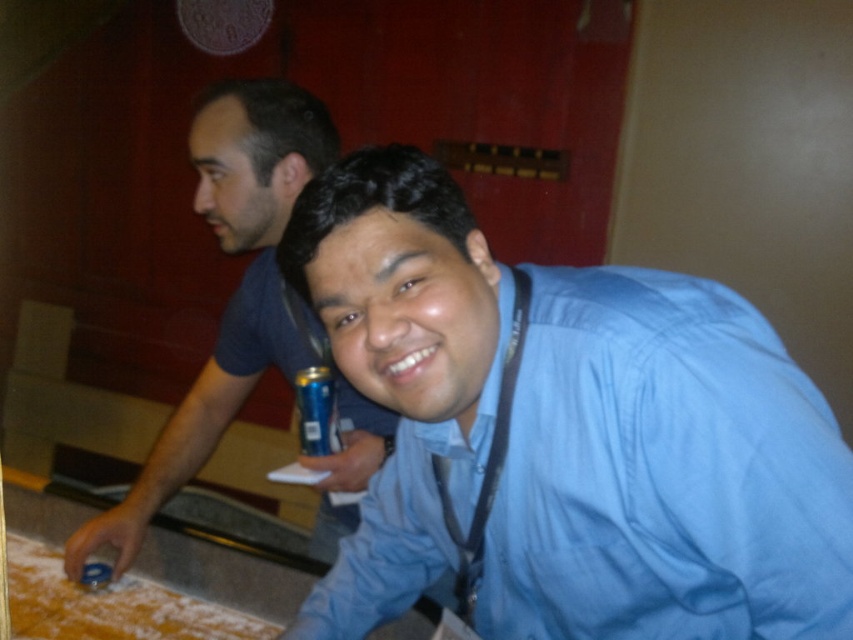
You are standing in the scene and want to hand a document to the person in the blue denim shirt at center. Which direction should you move to ensure you can reach them without obstructing the blue shirt at center?

Since the blue shirt at center is in front of the blue denim shirt at center, you should move around to the side or behind the blue shirt at center to reach the blue denim shirt at center without obstruction.

Based on the photo, you are standing in the room and want to reach both points. Which point, point (714, 436) or point (71, 616), would you reach first if you move towards them directly?

You would reach point (714, 436) first because it is closer to you than point (71, 616).

You are a chef in a kitchen and need to check the height of the blue shirt at center and the white powdery flour at lower left. Which one is taller?

The blue shirt at center has a greater height compared to the white powdery flour at lower left, so the blue shirt at center is taller.